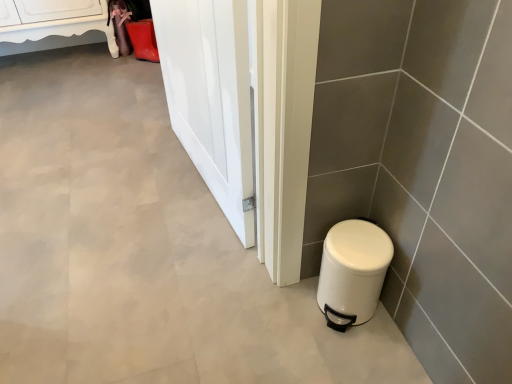
In order to face white glossy cabinet at upper left, should I rotate leftwards or rightwards?

It's best to rotate left around 26.201 degrees.

The width and height of the screenshot is (512, 384). What do you see at coordinates (352, 272) in the screenshot?
I see `white matte trash can at lower right` at bounding box center [352, 272].

Identify the location of white glossy door at center. (211, 97).

The height and width of the screenshot is (384, 512). I want to click on white glossy cabinet at upper left, so click(54, 20).

Which object is closer to the camera taking this photo, white matte trash can at lower right or white glossy cabinet at upper left?

white matte trash can at lower right is closer to the camera.

Is white matte trash can at lower right to the right of white glossy cabinet at upper left from the viewer's perspective?

Yes, white matte trash can at lower right is to the right of white glossy cabinet at upper left.

How many degrees apart are the facing directions of white matte trash can at lower right and white glossy cabinet at upper left?

They differ by 0.395 degrees in their facing directions.

Is white matte trash can at lower right touching white glossy cabinet at upper left?

No, white matte trash can at lower right is not in contact with white glossy cabinet at upper left.

From a real-world perspective, which is physically above, white matte trash can at lower right or white glossy door at center?

From a 3D spatial view, white glossy door at center is above.

Which is further, (362, 267) or (241, 204)?

The point (241, 204) is more distant.

Is white matte trash can at lower right at the right side of white glossy door at center?

Yes, white matte trash can at lower right is to the right of white glossy door at center.

Does white glossy door at center touch white matte trash can at lower right?

They are not placed beside each other.

Which object is positioned more to the right, white glossy door at center or white matte trash can at lower right?

white matte trash can at lower right.

How many degrees apart are the facing directions of white glossy door at center and white matte trash can at lower right?

The angle between the facing direction of white glossy door at center and the facing direction of white matte trash can at lower right is 83.1 degrees.

From a real-world perspective, is white glossy door at center located higher than white matte trash can at lower right?

Yes, from a real-world perspective, white glossy door at center is over white matte trash can at lower right

From a real-world perspective, which is physically above, white glossy cabinet at upper left or white matte trash can at lower right?

white glossy cabinet at upper left is physically above.

Is white glossy cabinet at upper left thinner than white matte trash can at lower right?

No.

Considering the positions of objects white glossy cabinet at upper left and white matte trash can at lower right in the image provided, who is more to the left, white glossy cabinet at upper left or white matte trash can at lower right?

white glossy cabinet at upper left.

Consider the image. Is the position of white glossy door at center more distant than that of white glossy cabinet at upper left?

No.

From the image's perspective, which one is positioned lower, white glossy door at center or white glossy cabinet at upper left?

white glossy door at center is shown below in the image.

Considering the sizes of objects white glossy door at center and white glossy cabinet at upper left in the image provided, who is bigger, white glossy door at center or white glossy cabinet at upper left?

With larger size is white glossy cabinet at upper left.

Can you confirm if white glossy cabinet at upper left is bigger than white glossy door at center?

Indeed, white glossy cabinet at upper left has a larger size compared to white glossy door at center.

Is white glossy cabinet at upper left thinner than white glossy door at center?

In fact, white glossy cabinet at upper left might be wider than white glossy door at center.

In the scene shown: Does white glossy cabinet at upper left lie in front of white glossy door at center?

No.

From a real-world perspective, is white glossy cabinet at upper left positioned over white glossy door at center based on gravity?

No, from a real-world perspective, white glossy cabinet at upper left is not over white glossy door at center

The image size is (512, 384). Find the location of `appliance beneath the white glossy cabinet at upper left (from a real-world perspective)`. appliance beneath the white glossy cabinet at upper left (from a real-world perspective) is located at coordinates (352, 272).

Locate an element on the screen. Image resolution: width=512 pixels, height=384 pixels. screen door located above the white matte trash can at lower right (from a real-world perspective) is located at coordinates (211, 97).

Looking at the image, which one is located further to white matte trash can at lower right, white glossy cabinet at upper left or white glossy door at center?

Based on the image, white glossy cabinet at upper left appears to be further to white matte trash can at lower right.

From the image, which object appears to be farther from white glossy cabinet at upper left, white matte trash can at lower right or white glossy door at center?

white matte trash can at lower right lies further to white glossy cabinet at upper left than the other object.

Considering their positions, is white matte trash can at lower right positioned closer to white glossy door at center than white glossy cabinet at upper left?

white matte trash can at lower right.

Which object lies further to the anchor point white glossy cabinet at upper left, white glossy door at center or white matte trash can at lower right?

The object further to white glossy cabinet at upper left is white matte trash can at lower right.

From the image, which object appears to be farther from white glossy door at center, white glossy cabinet at upper left or white matte trash can at lower right?

white glossy cabinet at upper left.

Considering their positions, is white glossy door at center positioned further to white matte trash can at lower right than white glossy cabinet at upper left?

The object further to white matte trash can at lower right is white glossy cabinet at upper left.

You are a GUI agent. You are given a task and a screenshot of the screen. Output one action in this format:
    pyautogui.click(x=<x>, y=<y>)
    Task: Click on the screen door between white glossy cabinet at upper left and white matte trash can at lower right in the horizontal direction
    The height and width of the screenshot is (384, 512).
    Given the screenshot: What is the action you would take?
    pyautogui.click(x=211, y=97)